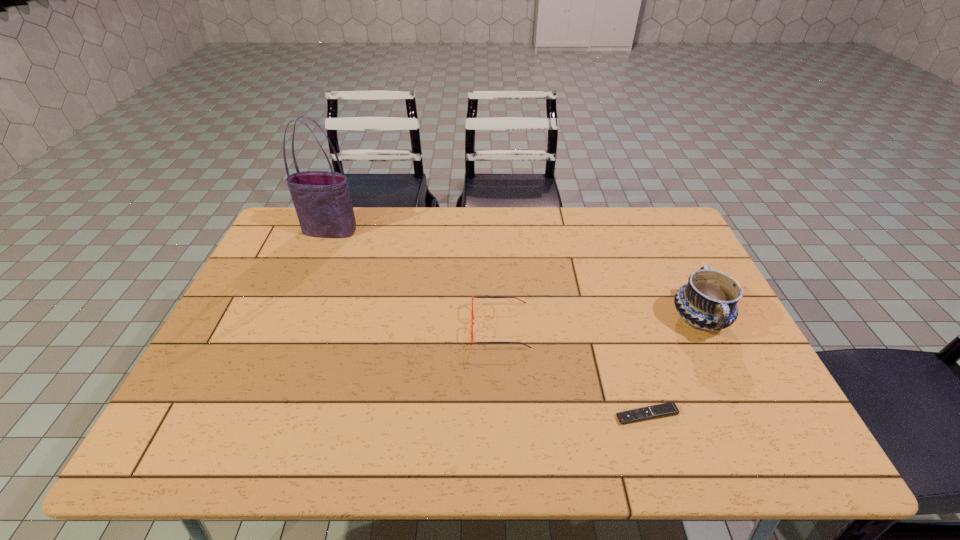
The width and height of the screenshot is (960, 540). I want to click on vacant space that satisfies the following two spatial constraints: 1. on the front side of the farthest object; 2. on the right side of the remote control, so click(255, 415).